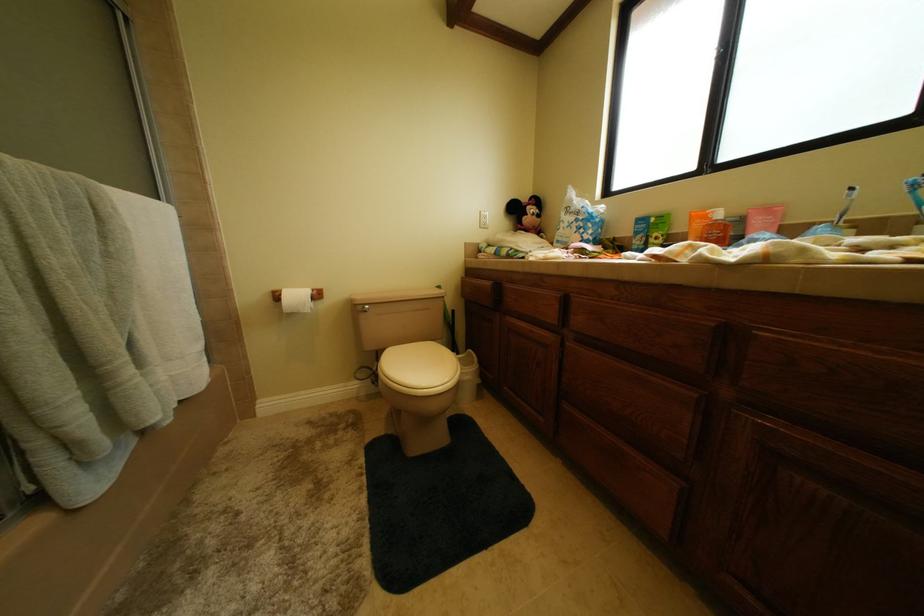
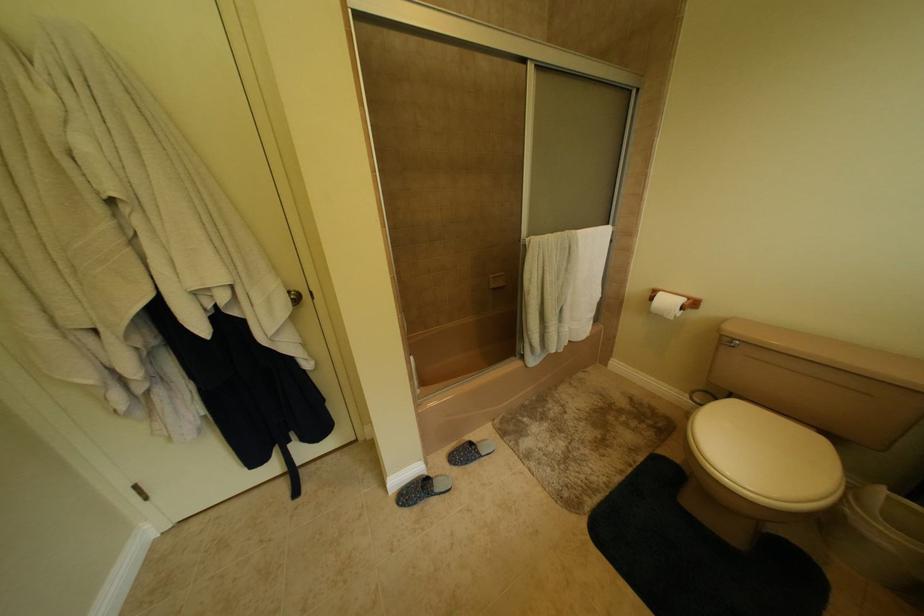
How did the camera likely rotate?

The camera rotated toward left-down.